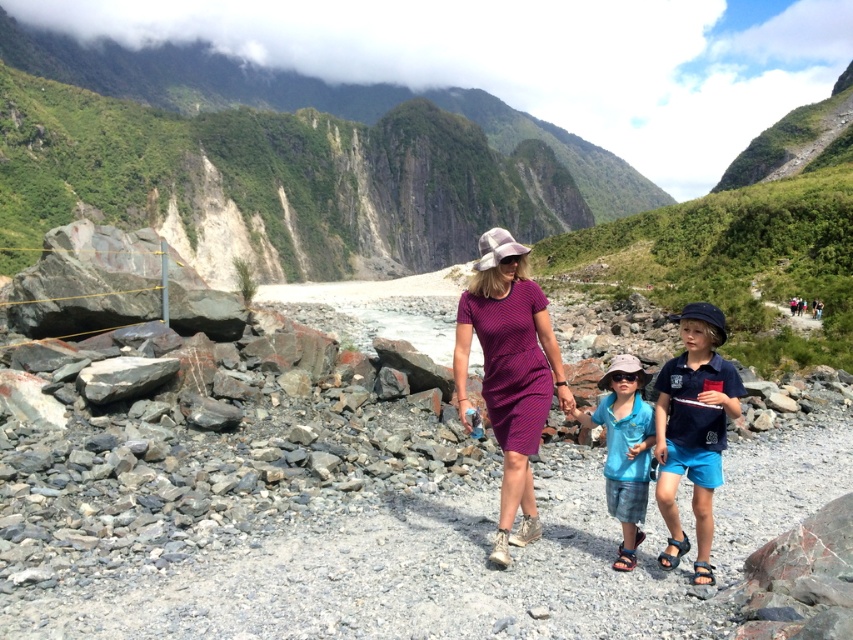
You are a photographer trying to capture a photo of the purple striped dress at center. The camera has a focal point at coordinates 0.5, 0.5. Will the dress be in focus?

The purple striped dress at center is located at point (509, 371), which is close to the camera focal point at (426, 320). Therefore, the dress will likely be in focus.

Based on the photo, you are a photographer standing at the starting point of the gravel path. You want to take a photo of the purple striped dress at center and the blue cotton shirt at center. If your camera has a maximum focus range of 3 meters, will you be able to capture both subjects clearly in the same frame?

The purple striped dress at center is 3.77 meters away from the blue cotton shirt at center. Since the distance between them exceeds the camera maximum focus range of 3 meters, you won not be able to capture both subjects clearly in the same frame.

You are a photographer trying to capture the group of people in the middle ground. The camera you are using has a limited field of view and can only focus on objects within a 0.2 radius around the center point. Given that the purple striped dress at center is represented by point (509, 371), will the photographer be able to include all three individuals in the photo?

The purple striped dress at center is represented by point (509, 371). Since the camera can focus within a 0.2 radius around the center, and the dress is at the center, the photographer can include all three individuals as they are positioned around the central point within the field of view.